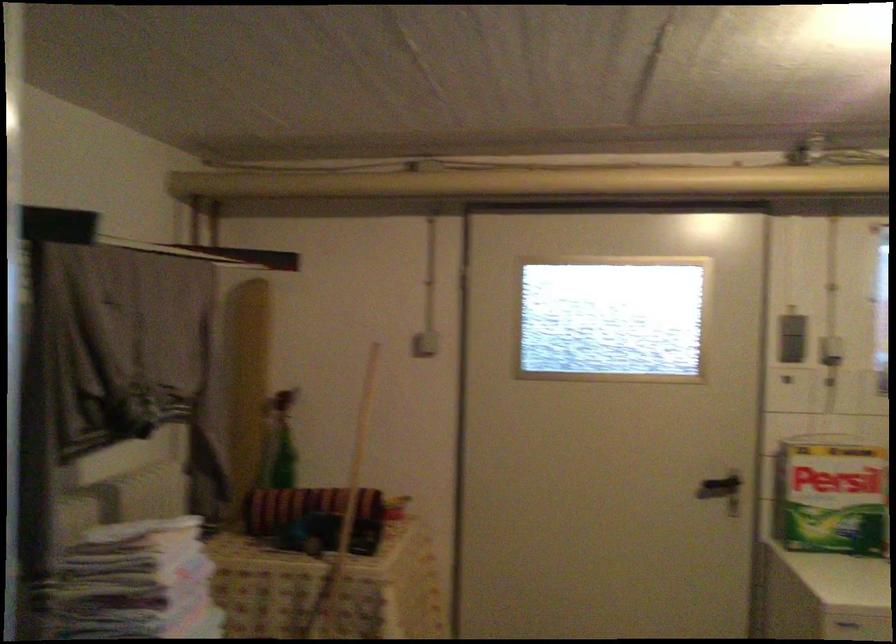
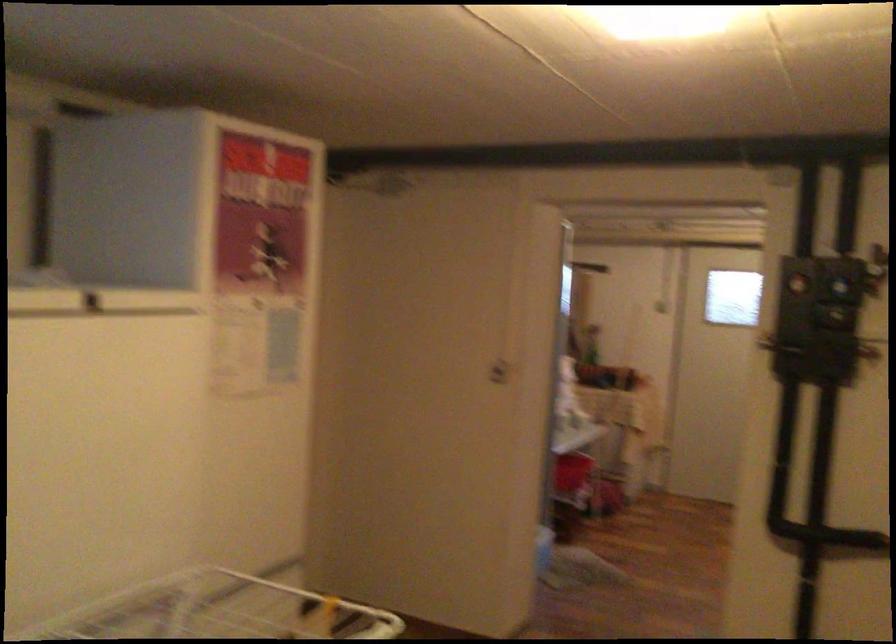
Question: I am providing you with two images of the same scene from different viewpoints. Please identify which objects are invisible in image2.

Choices:
 (A) blue control dial
 (B) red liquid tube
 (C) green spray bottle
 (D) refrigerator door handle

Answer: (C)